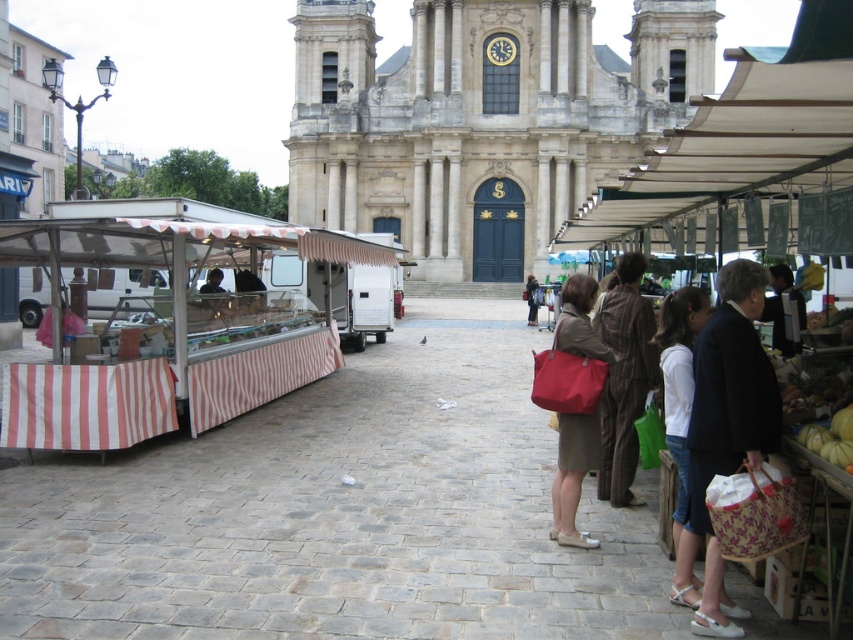
Which of these two, white fabric bag at center or matte black jacket at center, stands shorter?

Standing shorter between the two is matte black jacket at center.

Does point (670, 308) come closer to viewer compared to point (531, 296)?

Yes, point (670, 308) is in front of point (531, 296).

Is point (686, 305) positioned before point (527, 308)?

That is True.

At what (x,y) coordinates should I click in order to perform the action: click on white fabric bag at center. Please return your answer as a coordinate pair (x, y). This screenshot has height=640, width=853. Looking at the image, I should click on (x=682, y=426).

Which of these two, stone church at center or matte red bag at center, stands shorter?

matte red bag at center is shorter.

You are a GUI agent. You are given a task and a screenshot of the screen. Output one action in this format:
    pyautogui.click(x=<x>, y=<y>)
    Task: Click on the stone church at center
    The image size is (853, 640).
    Given the screenshot: What is the action you would take?
    pyautogui.click(x=480, y=120)

Locate an element on the screen. stone church at center is located at coordinates (480, 120).

Image resolution: width=853 pixels, height=640 pixels. What are the coordinates of `stone church at center` in the screenshot? It's located at (480, 120).

Is white striped fabric at left taller than matte red bag at center?

No, white striped fabric at left is not taller than matte red bag at center.

Which is below, white striped fabric at left or matte red bag at center?

matte red bag at center

Which is in front, point (216, 253) or point (560, 518)?

Point (560, 518) is more forward.

Identify the location of white striped fabric at left. (172, 323).